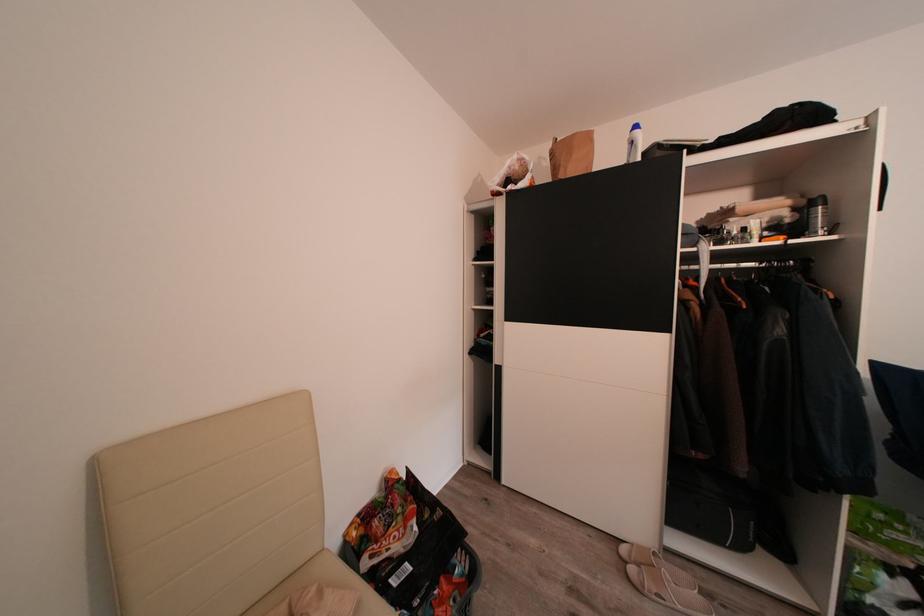
The image size is (924, 616). In order to click on black instrument case in this screenshot , I will do `click(709, 506)`.